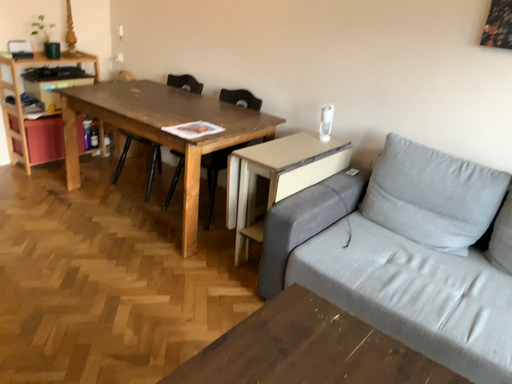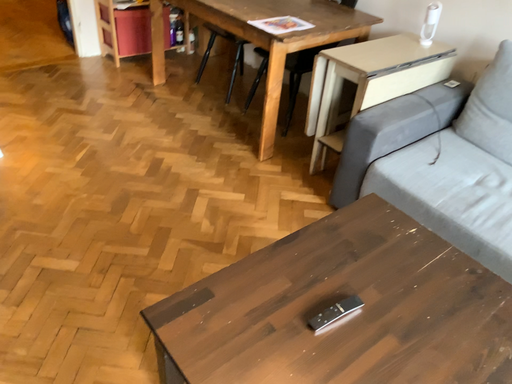
Question: Which way did the camera rotate in the video?

Choices:
 (A) rotated upward
 (B) rotated downward

Answer: (B)